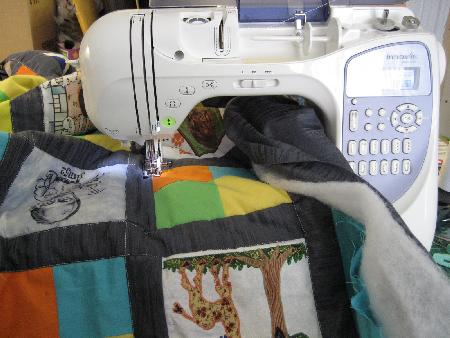
The image size is (450, 338). I want to click on blanket, so click(x=243, y=223).